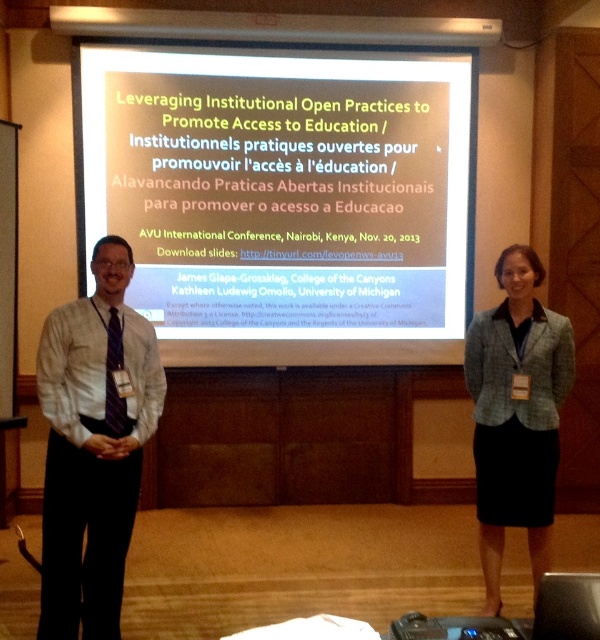
Who is taller, white matte projection screen at center or green tweed blazer at center?

With more height is white matte projection screen at center.

Does point (301, 83) lie in front of point (496, 516)?

No, (301, 83) is further to viewer.

Locate an element on the screen. The width and height of the screenshot is (600, 640). white matte projection screen at center is located at coordinates (283, 196).

From the picture: Is white shirt at left above green tweed blazer at center?

Indeed, white shirt at left is positioned over green tweed blazer at center.

Between white shirt at left and green tweed blazer at center, which one appears on the left side from the viewer's perspective?

white shirt at left is more to the left.

I want to click on white shirt at left, so coord(94,445).

Does point (136, 81) lie behind point (82, 529)?

Yes.

Between point (153, 230) and point (79, 444), which one is positioned in front?

Point (79, 444) is in front.

The width and height of the screenshot is (600, 640). In order to click on white matte projection screen at center in this screenshot , I will do click(x=283, y=196).